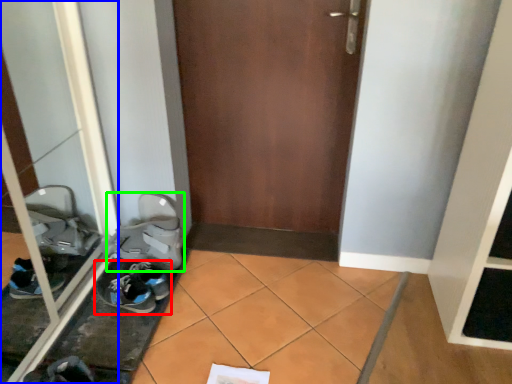
Question: Which is nearer to the footwear (highlighted by a red box)? glass door (highlighted by a blue box) or footwear (highlighted by a green box).

Choices:
 (A) glass door
 (B) footwear

Answer: (B)